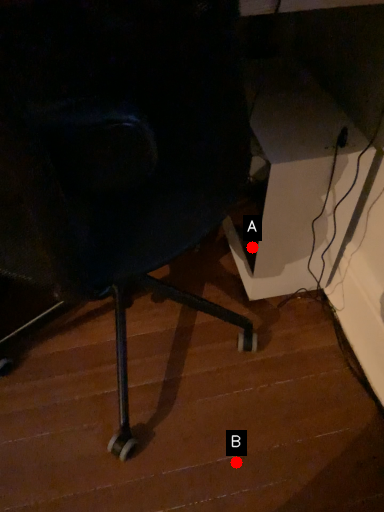
Question: Two points are circled on the image, labeled by A and B beside each circle. Which point is further to the camera?

Choices:
 (A) A is further
 (B) B is further

Answer: (A)